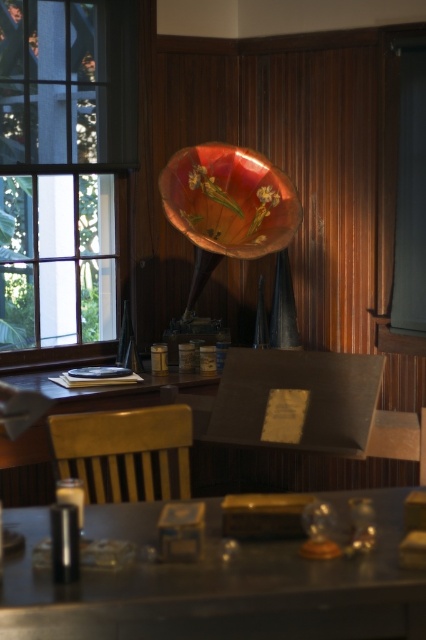
Is metallic silver table at center smaller than wooden chair at center?

Correct, metallic silver table at center occupies less space than wooden chair at center.

Does metallic silver table at center have a lesser width compared to wooden chair at center?

Incorrect, metallic silver table at center's width is not less than wooden chair at center's.

Measure the distance between metallic silver table at center and camera.

metallic silver table at center and camera are 5.81 feet apart.

Where is `metallic silver table at center`? Image resolution: width=426 pixels, height=640 pixels. metallic silver table at center is located at coordinates (221, 592).

Can you confirm if clear glass window at left is positioned above metallic silver table at center?

Yes.

Which is more to the left, clear glass window at left or metallic silver table at center?

Positioned to the left is clear glass window at left.

Between point (103, 67) and point (374, 580), which one is positioned behind?

The point (103, 67) is behind.

The width and height of the screenshot is (426, 640). I want to click on clear glass window at left, so click(63, 173).

Is clear glass window at left positioned at the back of wooden chair at center?

Yes, it is behind wooden chair at center.

Which is behind, point (58, 230) or point (106, 481)?

Positioned behind is point (58, 230).

Identify the location of clear glass window at left. (63, 173).